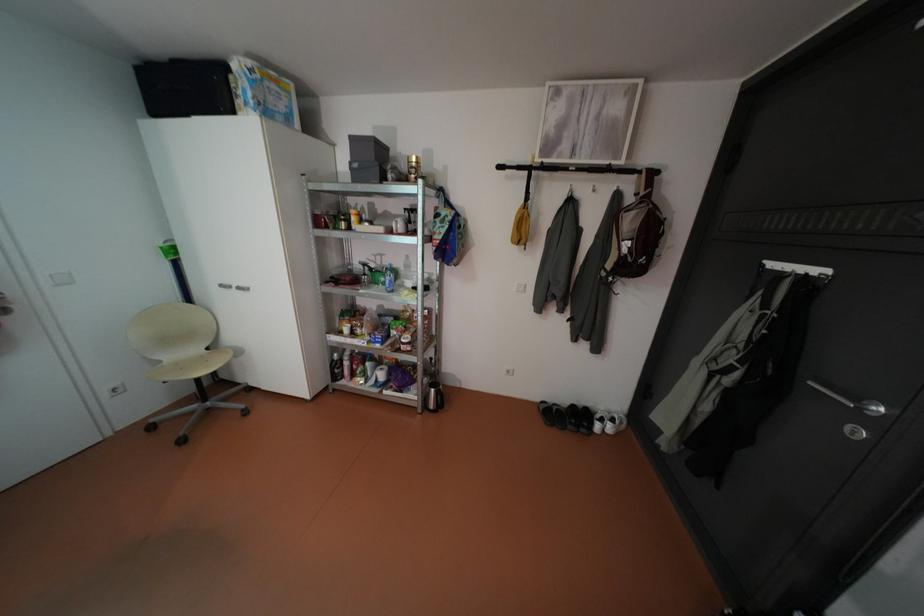
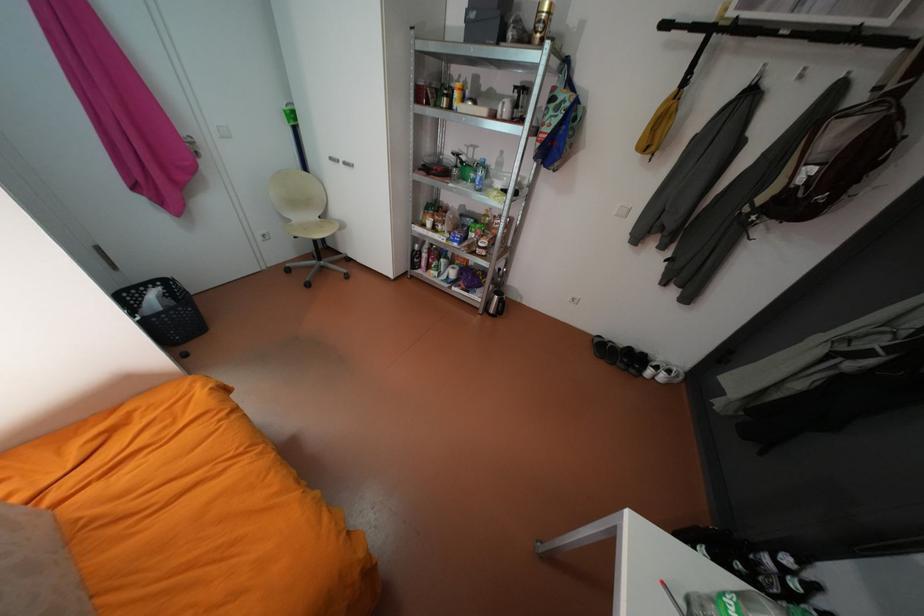
The point at [383,282] is marked in the first image. Where is the corresponding point in the second image?

(471, 177)